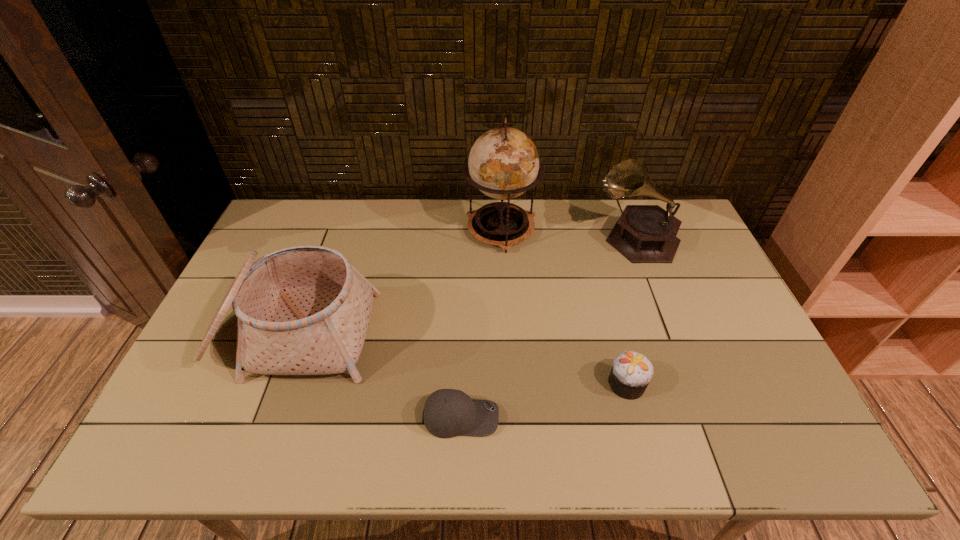
Locate an element on the screen. The height and width of the screenshot is (540, 960). free location located 0.150m on the back of the cupcake is located at coordinates (611, 322).

Where is `free spot located 0.210m on the front brim of the baseball cap`? The width and height of the screenshot is (960, 540). free spot located 0.210m on the front brim of the baseball cap is located at coordinates (588, 417).

The image size is (960, 540). In order to click on globe at the far edge in this screenshot , I will do `click(503, 163)`.

You are a GUI agent. You are given a task and a screenshot of the screen. Output one action in this format:
    pyautogui.click(x=<x>, y=<y>)
    Task: Click on the phonograph record that is at the far edge
    The image size is (960, 540).
    Given the screenshot: What is the action you would take?
    pyautogui.click(x=644, y=233)

Find the location of a particular element. Image resolution: width=960 pixels, height=540 pixels. object that is positioned at the near edge is located at coordinates (447, 413).

Find the location of a particular element. The image size is (960, 540). object that is positioned at the left edge is located at coordinates (303, 310).

The image size is (960, 540). I want to click on object that is at the right edge, so click(x=644, y=233).

Image resolution: width=960 pixels, height=540 pixels. Identify the location of object at the far right corner. (644, 233).

You are a GUI agent. You are given a task and a screenshot of the screen. Output one action in this format:
    pyautogui.click(x=<x>, y=<y>)
    Task: Click on the vacant area at the far edge of the desktop
    
    Given the screenshot: What is the action you would take?
    pyautogui.click(x=328, y=230)

This screenshot has height=540, width=960. In the image, there is a desktop. What are the coordinates of `vacant area at the near edge` in the screenshot? It's located at (319, 450).